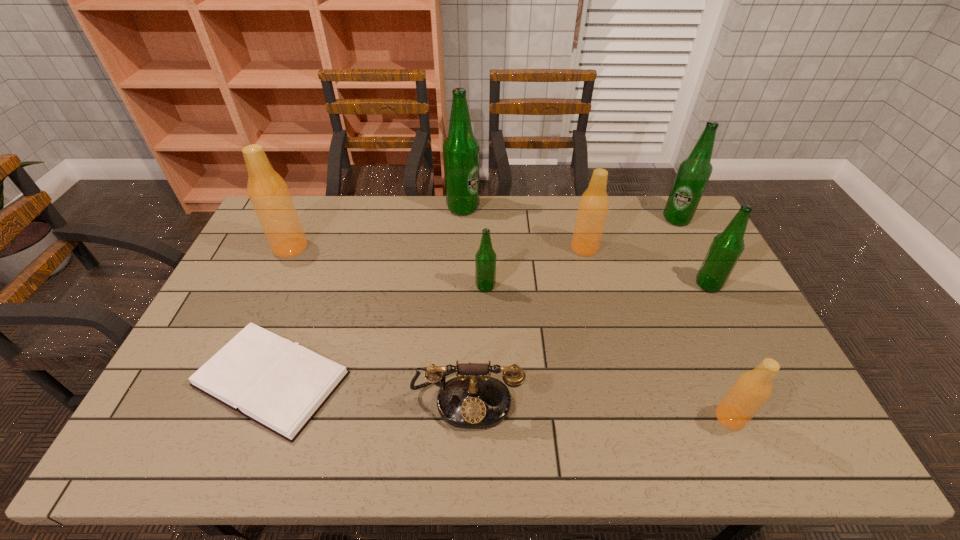
I want to click on beer bottle present at the left edge, so click(269, 194).

Identify the location of hardback book positioned at the left edge. (280, 385).

The height and width of the screenshot is (540, 960). Find the location of `object positioned at the near left corner`. object positioned at the near left corner is located at coordinates (280, 385).

Find the location of `object that is at the far right corner`. object that is at the far right corner is located at coordinates (693, 174).

Image resolution: width=960 pixels, height=540 pixels. What are the coordinates of `object at the near right corner` in the screenshot? It's located at (751, 390).

This screenshot has width=960, height=540. In the image, there is a desktop. What are the coordinates of `vacant region at the far edge` in the screenshot? It's located at (329, 209).

Where is `free space at the near edge`? free space at the near edge is located at coordinates (517, 431).

At what (x,y) coordinates should I click in order to perform the action: click on free spot at the left edge of the desktop. Please return your answer as a coordinate pair (x, y). Looking at the image, I should click on (x=212, y=322).

Locate an element on the screen. This screenshot has width=960, height=540. vacant area at the right edge of the desktop is located at coordinates (739, 298).

Image resolution: width=960 pixels, height=540 pixels. I want to click on free space at the far left corner, so click(304, 210).